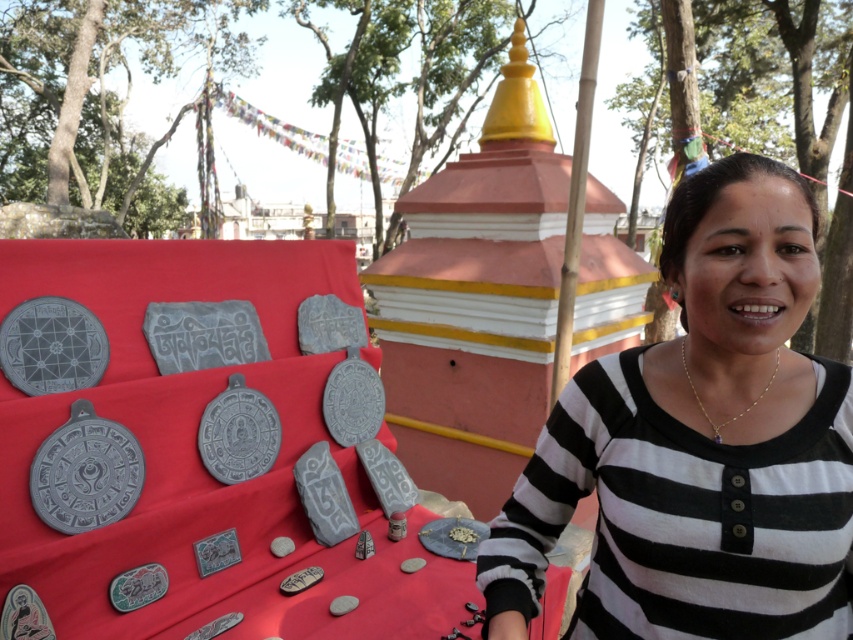
Can you confirm if black striped shirt at right is smaller than gold chain necklace at center?

No, black striped shirt at right is not smaller than gold chain necklace at center.

Is point (517, 561) positioned in front of point (778, 364)?

No, (517, 561) is behind (778, 364).

Where is `black striped shirt at right`? The height and width of the screenshot is (640, 853). black striped shirt at right is located at coordinates (700, 444).